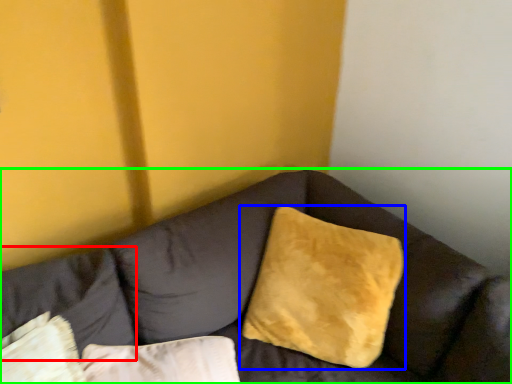
Question: Which object is the closest to the pillow (highlighted by a red box)? Choose among these: pillow (highlighted by a blue box) or studio couch (highlighted by a green box).

Choices:
 (A) pillow
 (B) studio couch

Answer: (B)